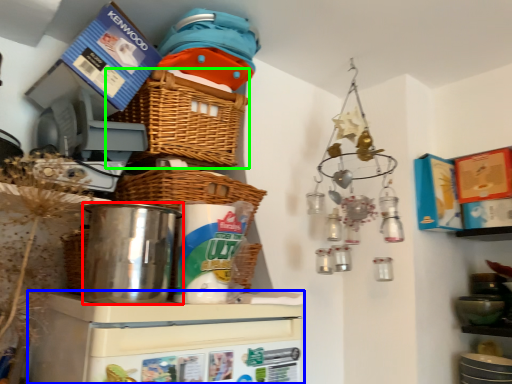
Question: Considering the real-world distances, which object is closest to appliance (highlighted by a red box)? appliance (highlighted by a blue box) or basket (highlighted by a green box).

Choices:
 (A) appliance
 (B) basket

Answer: (A)